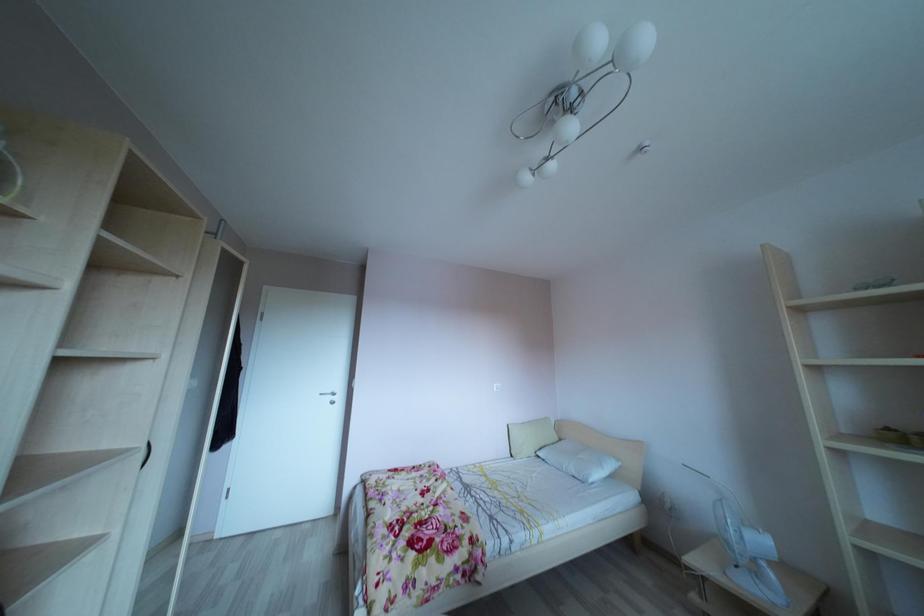
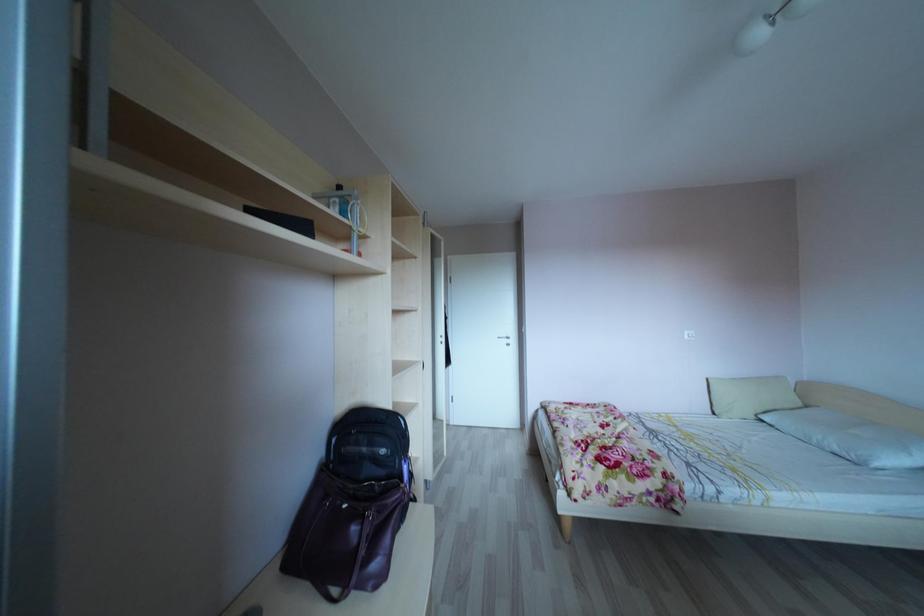
Question: The images are taken continuously from a first-person perspective. In which direction is your viewpoint rotating?

Choices:
 (A) Left
 (B) Right
 (C) Up
 (D) Down

Answer: (A)